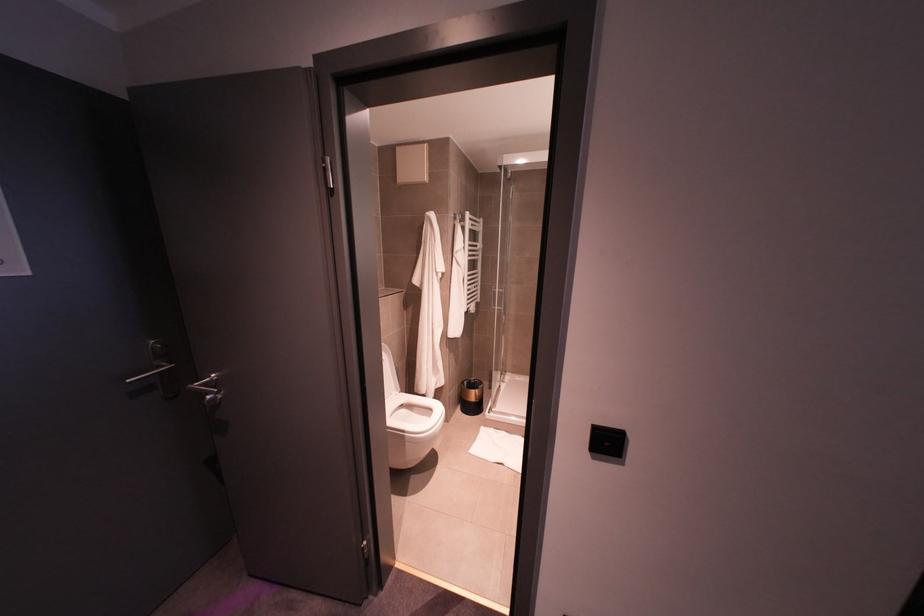
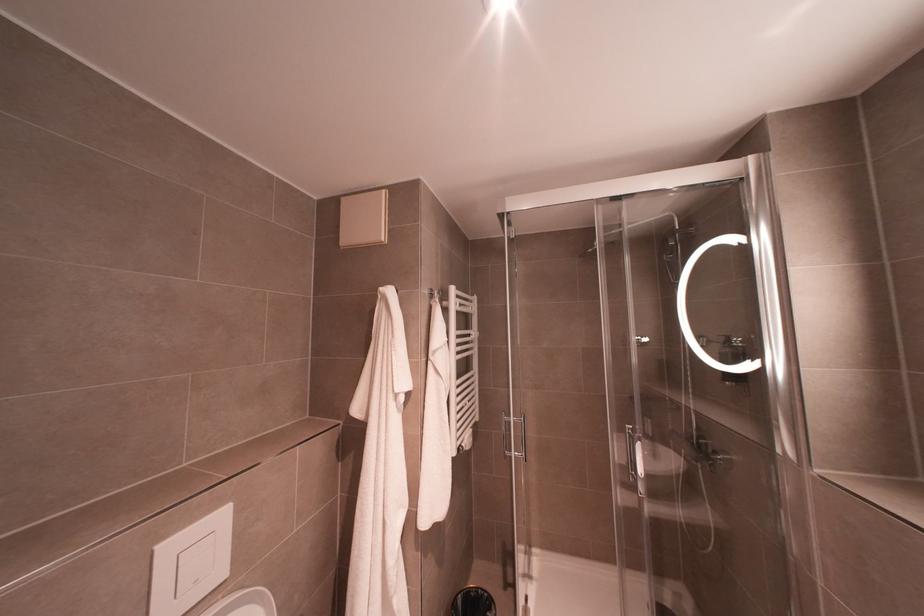
Locate, in the second image, the point that corresponds to pixel 494 305 in the first image.

(511, 451)